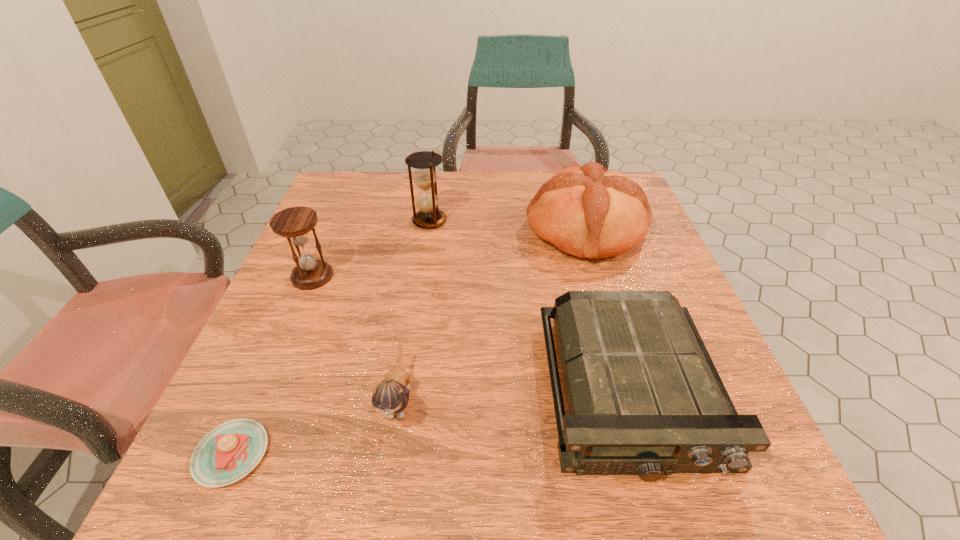
The image size is (960, 540). I want to click on free space located 0.400m on the back of the pastry, so click(x=314, y=264).

This screenshot has height=540, width=960. Identify the location of hourglass that is at the far edge. (425, 162).

Identify the location of bread present at the far edge. (587, 211).

Identify the location of radio receiver located at the near edge. tap(644, 397).

Identify the location of pastry at the near edge. The width and height of the screenshot is (960, 540). (229, 452).

You are a GUI agent. You are given a task and a screenshot of the screen. Output one action in this format:
    pyautogui.click(x=<x>, y=<y>)
    Task: Click on the hourglass that is at the left edge
    Image resolution: width=960 pixels, height=540 pixels.
    Given the screenshot: What is the action you would take?
    pyautogui.click(x=294, y=223)

Locate an element on the screen. Image resolution: width=960 pixels, height=540 pixels. pastry at the left edge is located at coordinates (229, 452).

Where is `bread that is at the right edge`? The image size is (960, 540). bread that is at the right edge is located at coordinates (587, 211).

Image resolution: width=960 pixels, height=540 pixels. In order to click on radio receiver that is at the right edge in this screenshot , I will do `click(644, 397)`.

Identify the location of object that is at the near left corner. (229, 452).